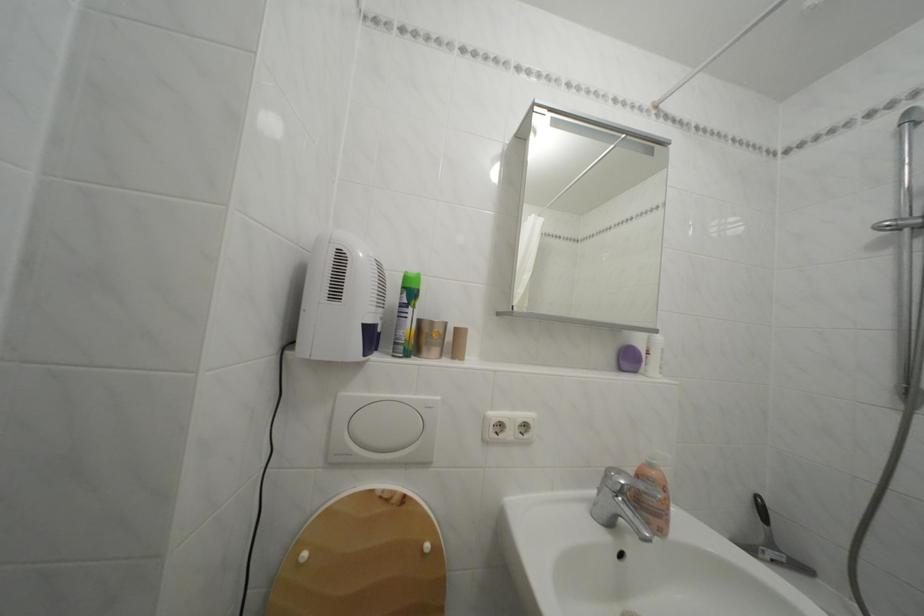
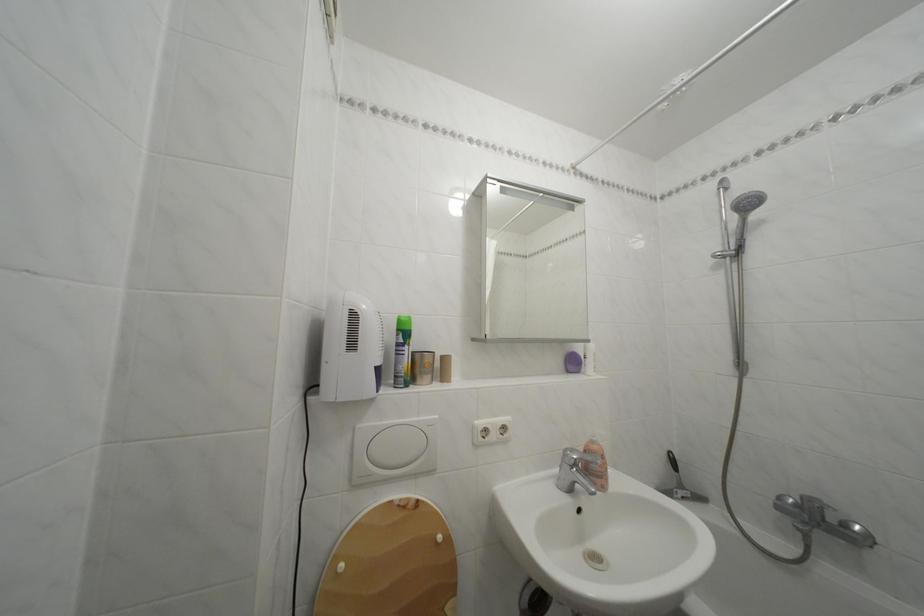
Where in the second image is the point corresponding to (782,553) from the first image?

(689, 492)